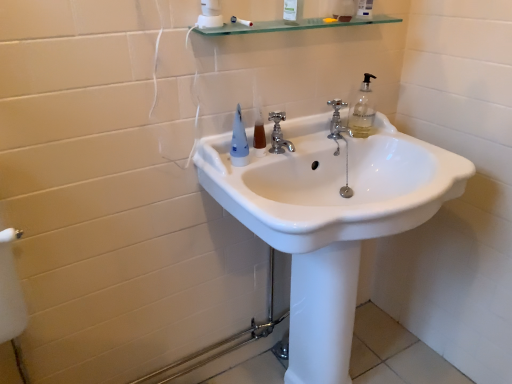
Find the location of a particular element. The height and width of the screenshot is (384, 512). translucent plastic mouthwash at center is located at coordinates (259, 134).

At what (x,y) coordinates should I click in order to perform the action: click on white glossy sink at center. Please return your answer as a coordinate pair (x, y). Looking at the image, I should click on (329, 219).

The image size is (512, 384). What do you see at coordinates (279, 134) in the screenshot?
I see `polished chrome faucet at center, the 1th tap from the left` at bounding box center [279, 134].

Locate an element on the screen. The height and width of the screenshot is (384, 512). translucent plastic mouthwash at center is located at coordinates (259, 134).

In the image, is translucent plastic mouthwash at center on the left side or the right side of transparent glass shelf at upper center?

translucent plastic mouthwash at center is positioned on transparent glass shelf at upper center's left side.

What's the angular difference between translucent plastic mouthwash at center and transparent glass shelf at upper center's facing directions?

There is a 3.57-degree angle between the facing directions of translucent plastic mouthwash at center and transparent glass shelf at upper center.

From a real-world perspective, who is located lower, translucent plastic mouthwash at center or transparent glass shelf at upper center?

translucent plastic mouthwash at center, from a real-world perspective.

Measure the distance between polished chrome faucet at center, the 1th tap from the left, and translucent plastic mouthwash at center.

polished chrome faucet at center, the 1th tap from the left, and translucent plastic mouthwash at center are 1.79 inches apart.

Is point (281, 147) farther from viewer compared to point (261, 133)?

No, (281, 147) is in front of (261, 133).

Is polished chrome faucet at center, the second tap when ordered from right to left, with translucent plastic mouthwash at center?

Yes, the surface of polished chrome faucet at center, the second tap when ordered from right to left, is in contact with translucent plastic mouthwash at center.

From a real-world perspective, is polished chrome faucet at center, which ranks as the 1th tap in front-to-back order, on top of translucent plastic mouthwash at center?

Indeed, from a real-world perspective, polished chrome faucet at center, which ranks as the 1th tap in front-to-back order, stands above translucent plastic mouthwash at center.

Looking at this image, how different are the orientations of white glossy sink at center and polished chrome faucet at center, which ranks as the 1th tap in front-to-back order, in degrees?

white glossy sink at center and polished chrome faucet at center, which ranks as the 1th tap in front-to-back order, are facing 7.39 degrees away from each other.

Which is more to the right, white glossy sink at center or polished chrome faucet at center, marked as the 2th tap in a back-to-front arrangement?

From the viewer's perspective, white glossy sink at center appears more on the right side.

Measure the distance from white glossy sink at center to polished chrome faucet at center, which ranks as the 1th tap in front-to-back order.

white glossy sink at center is 11.80 inches away from polished chrome faucet at center, which ranks as the 1th tap in front-to-back order.

In terms of height, does white glossy sink at center look taller or shorter compared to polished chrome faucet at center, marked as the 2th tap in a back-to-front arrangement?

Clearly, white glossy sink at center is taller compared to polished chrome faucet at center, marked as the 2th tap in a back-to-front arrangement.

Considering the sizes of objects transparent glass shelf at upper center and matte blue plastic toothbrush at upper center in the image provided, who is taller, transparent glass shelf at upper center or matte blue plastic toothbrush at upper center?

matte blue plastic toothbrush at upper center is taller.

Is transparent glass shelf at upper center facing away from matte blue plastic toothbrush at upper center?

transparent glass shelf at upper center does not have its back to matte blue plastic toothbrush at upper center.

Consider the image. Which object is closer to the camera, transparent glass shelf at upper center or matte blue plastic toothbrush at upper center?

transparent glass shelf at upper center is more forward.

Which is farther, (267, 24) or (240, 115)?

The point (240, 115) is farther.

Is polished chrome faucet at center, the 1th tap from the left, wider than polished chrome faucet at center, the second tap in the front-to-back sequence?

In fact, polished chrome faucet at center, the 1th tap from the left, might be narrower than polished chrome faucet at center, the second tap in the front-to-back sequence.

Can you tell me how much polished chrome faucet at center, the second tap when ordered from right to left, and polished chrome faucet at center, the second tap in the front-to-back sequence, differ in facing direction?

They differ by 0.00125 degrees in their facing directions.

Who is bigger, polished chrome faucet at center, which ranks as the 1th tap in front-to-back order, or polished chrome faucet at center, the second tap in the front-to-back sequence?

polished chrome faucet at center, which ranks as the 1th tap in front-to-back order, is bigger.

Is point (273, 147) positioned in front of point (333, 125)?

That is True.

Is translucent plastic mouthwash at center not within polished chrome faucet at center, the 1th tap from the left?

translucent plastic mouthwash at center is positioned outside polished chrome faucet at center, the 1th tap from the left.

Is translucent plastic mouthwash at center in front of or behind polished chrome faucet at center, the second tap when ordered from right to left, in the image?

Visually, translucent plastic mouthwash at center is located in front of polished chrome faucet at center, the second tap when ordered from right to left.

Between translucent plastic mouthwash at center and polished chrome faucet at center, the 1th tap from the left, which one has more height?

Standing taller between the two is polished chrome faucet at center, the 1th tap from the left.

Considering the relative sizes of translucent plastic mouthwash at center and polished chrome faucet at center, the second tap when ordered from right to left, in the image provided, is translucent plastic mouthwash at center thinner than polished chrome faucet at center, the second tap when ordered from right to left,?

Yes, translucent plastic mouthwash at center is thinner than polished chrome faucet at center, the second tap when ordered from right to left.

Can you tell me how much polished chrome faucet at center, the 1th tap from the left, and white glossy sink at center differ in facing direction?

The facing directions of polished chrome faucet at center, the 1th tap from the left, and white glossy sink at center are 7.39 degrees apart.

From a real-world perspective, does polished chrome faucet at center, which ranks as the 1th tap in front-to-back order, sit lower than white glossy sink at center?

Incorrect, from a real-world perspective, polished chrome faucet at center, which ranks as the 1th tap in front-to-back order, is higher than white glossy sink at center.

Between polished chrome faucet at center, the second tap when ordered from right to left, and white glossy sink at center, which one has more height?

Standing taller between the two is white glossy sink at center.

Considering the sizes of objects polished chrome faucet at center, the 1th tap from the left, and white glossy sink at center in the image provided, who is thinner, polished chrome faucet at center, the 1th tap from the left, or white glossy sink at center?

Thinner between the two is polished chrome faucet at center, the 1th tap from the left.

Locate an element on the screen. Image resolution: width=512 pixels, height=384 pixels. mouthwash below the transparent glass shelf at upper center (from the image's perspective) is located at coordinates (259, 134).

Identify the location of the 1st tap behind the translucent plastic mouthwash at center, starting your count from the anchor. (279, 134).

Looking at the image, which one is located closer to matte blue plastic toothbrush at upper center, translucent plastic mouthwash at center or polished chrome faucet at center, the second tap when ordered from right to left?

translucent plastic mouthwash at center is closer to matte blue plastic toothbrush at upper center.

From the image, which object appears to be nearer to transparent glass shelf at upper center, matte blue plastic toothbrush at upper center or white glossy sink at center?

matte blue plastic toothbrush at upper center.

When comparing their distances from polished chrome faucet at center, which is the 2th tap from left to right, does white glossy sink at center or translucent plastic mouthwash at center seem further?

white glossy sink at center is further to polished chrome faucet at center, which is the 2th tap from left to right.

Estimate the real-world distances between objects in this image. Which object is further from matte blue plastic toothbrush at upper center, polished chrome faucet at center, marked as the 2th tap in a back-to-front arrangement, or white glossy sink at center?

The object further to matte blue plastic toothbrush at upper center is white glossy sink at center.

Looking at the image, which one is located further to translucent plastic mouthwash at center, polished chrome faucet at center, which is the 2th tap from left to right, or transparent glass shelf at upper center?

Based on the image, transparent glass shelf at upper center appears to be further to translucent plastic mouthwash at center.

From the picture: Considering their positions, is matte blue plastic toothbrush at upper center positioned closer to polished chrome faucet at center, the second tap in the front-to-back sequence, than white glossy sink at center?

Among the two, matte blue plastic toothbrush at upper center is located nearer to polished chrome faucet at center, the second tap in the front-to-back sequence.

Which object lies nearer to the anchor point matte blue plastic toothbrush at upper center, white glossy sink at center or polished chrome faucet at center, the 1th tap positioned from the right?

polished chrome faucet at center, the 1th tap positioned from the right, is closer to matte blue plastic toothbrush at upper center.

Based on their spatial positions, is transparent glass shelf at upper center or polished chrome faucet at center, which is the 2th tap from left to right, further from polished chrome faucet at center, the second tap when ordered from right to left?

The object further to polished chrome faucet at center, the second tap when ordered from right to left, is transparent glass shelf at upper center.

Locate an element on the screen. Image resolution: width=512 pixels, height=384 pixels. mouthwash between transparent glass shelf at upper center and white glossy sink at center in the vertical direction is located at coordinates (259, 134).

Find the location of a particular element. bottle between translucent plastic mouthwash at center and white glossy sink at center in the up-down direction is located at coordinates (239, 142).

The width and height of the screenshot is (512, 384). In order to click on tap between transparent glass shelf at upper center and polished chrome faucet at center, marked as the 2th tap in a back-to-front arrangement, in the vertical direction in this screenshot , I will do `click(337, 120)`.

Find the location of a particular element. tap that lies between polished chrome faucet at center, the second tap in the front-to-back sequence, and white glossy sink at center from top to bottom is located at coordinates (279, 134).